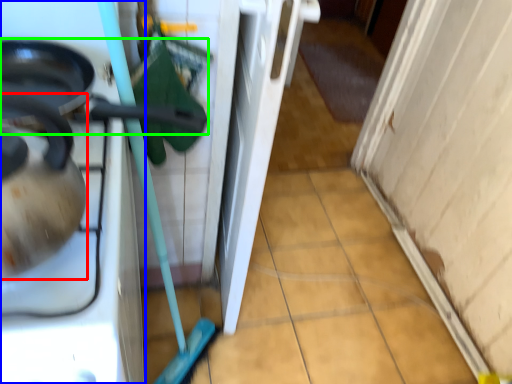
Question: Which is farther away from tea pot (highlighted by a red box)? home appliance (highlighted by a blue box) or frying pan (highlighted by a green box)?

Choices:
 (A) home appliance
 (B) frying pan

Answer: (B)